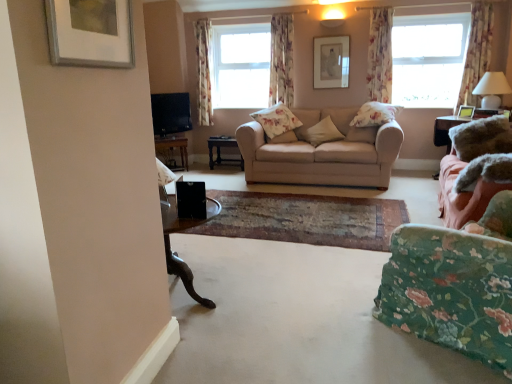
What are the coordinates of `free location above fluffy white pillow at center, which is the fifth pillow from front to back (from a real-world perspective)` in the screenshot? It's located at (283, 127).